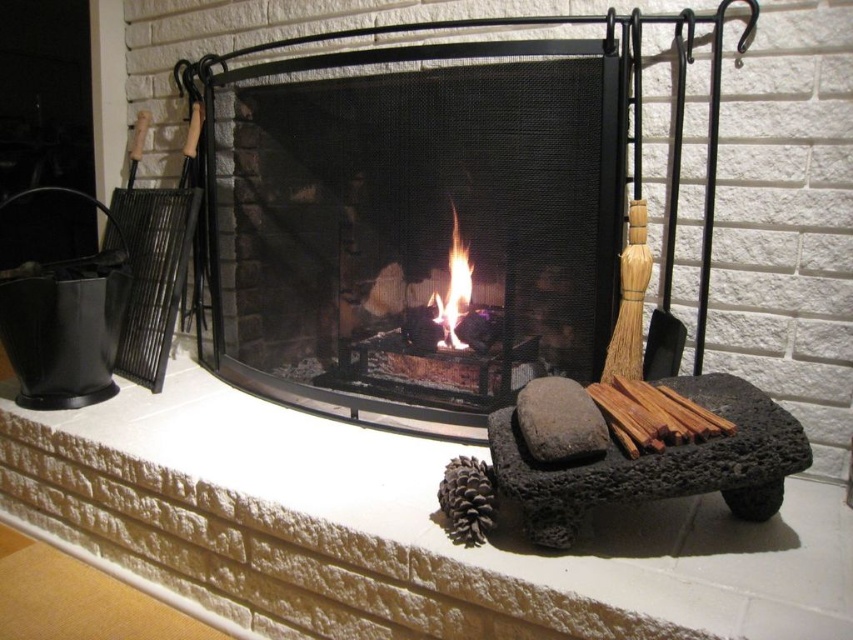
Can you confirm if black mesh fireplace screen at center is positioned above brown textured pine cone at center?

Correct, black mesh fireplace screen at center is located above brown textured pine cone at center.

Where is `black mesh fireplace screen at center`? Image resolution: width=853 pixels, height=640 pixels. black mesh fireplace screen at center is located at coordinates (410, 224).

Who is more forward, (462, 509) or (456, 268)?

Positioned in front is point (462, 509).

Which is more to the right, brown textured pine cone at center or flametransparentfire at center?

From the viewer's perspective, brown textured pine cone at center appears more on the right side.

You are a GUI agent. You are given a task and a screenshot of the screen. Output one action in this format:
    pyautogui.click(x=<x>, y=<y>)
    Task: Click on the brown textured pine cone at center
    Image resolution: width=853 pixels, height=640 pixels.
    Given the screenshot: What is the action you would take?
    pyautogui.click(x=467, y=499)

The width and height of the screenshot is (853, 640). Find the location of `brown textured pine cone at center`. brown textured pine cone at center is located at coordinates (467, 499).

Which is above, black mesh fireplace screen at center or flametransparentfire at center?

black mesh fireplace screen at center is above.

Who is more forward, (584, 259) or (450, 278)?

Point (584, 259) is in front.

Describe the element at coordinates (410, 224) in the screenshot. This screenshot has height=640, width=853. I see `black mesh fireplace screen at center` at that location.

Identify the location of black mesh fireplace screen at center. The height and width of the screenshot is (640, 853). coord(410,224).